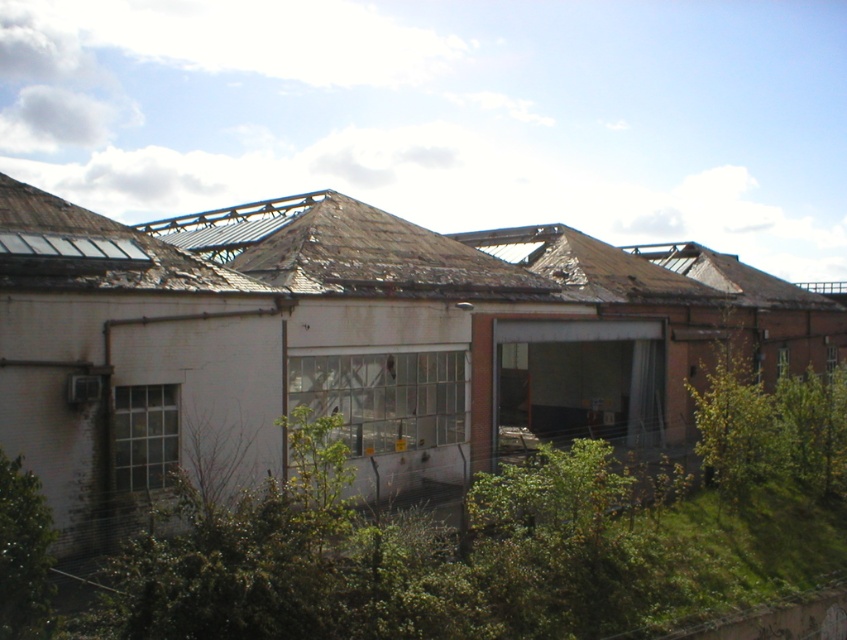
Can you confirm if weathered brown roof at upper center is shorter than green leafy bush at lower left?

No, weathered brown roof at upper center is not shorter than green leafy bush at lower left.

In order to click on weathered brown roof at upper center in this screenshot , I will do `click(447, 257)`.

Image resolution: width=847 pixels, height=640 pixels. I want to click on weathered brown roof at upper center, so click(x=447, y=257).

Does green leafy shrub at center appear under weathered brown roof at upper center?

Yes, green leafy shrub at center is below weathered brown roof at upper center.

Is green leafy shrub at center to the right of weathered brown roof at upper center from the viewer's perspective?

Yes, green leafy shrub at center is to the right of weathered brown roof at upper center.

Between point (493, 525) and point (378, 216), which one is positioned in front?

Positioned in front is point (493, 525).

In order to click on green leafy shrub at center in this screenshot , I will do `click(496, 532)`.

Is green leafy shrub at center in front of green leafy bush at lower left?

No, it is behind green leafy bush at lower left.

Can you confirm if green leafy shrub at center is wider than green leafy bush at lower left?

Correct, the width of green leafy shrub at center exceeds that of green leafy bush at lower left.

Does point (167, 572) lie in front of point (10, 465)?

That is False.

Where is `green leafy shrub at center`? This screenshot has width=847, height=640. green leafy shrub at center is located at coordinates (496, 532).